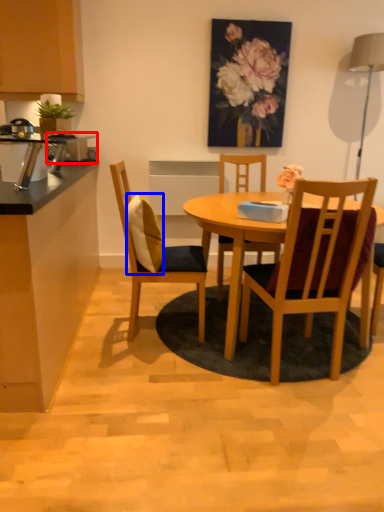
Question: Which point is closer to the camera, appliance (highlighted by a red box) or pillow (highlighted by a blue box)?

Choices:
 (A) appliance
 (B) pillow

Answer: (B)